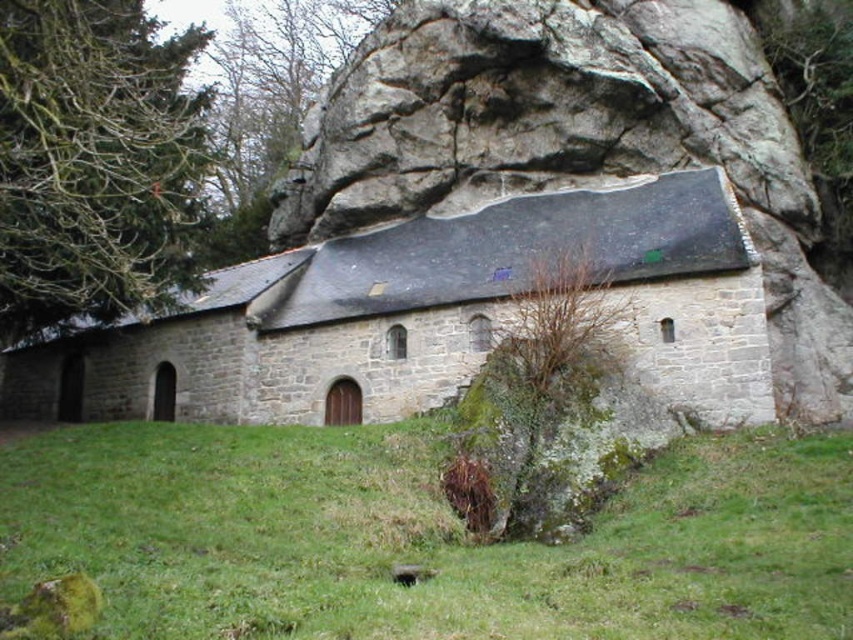
You are standing at the entrance of the chapel and notice a specific point marked at coordinates point (x=425, y=540). What is the terrain like at that exact location?

The terrain at point (x=425, y=540) is green grass at lower center.

You are a gardener who wants to mow the green grass at lower center. However, there is a green leafy tree at upper left nearby. Will the tree be in the way of your mowing path?

The green grass at lower center is not as tall as the green leafy tree at upper left, so the tree is taller and might block the mowing path.